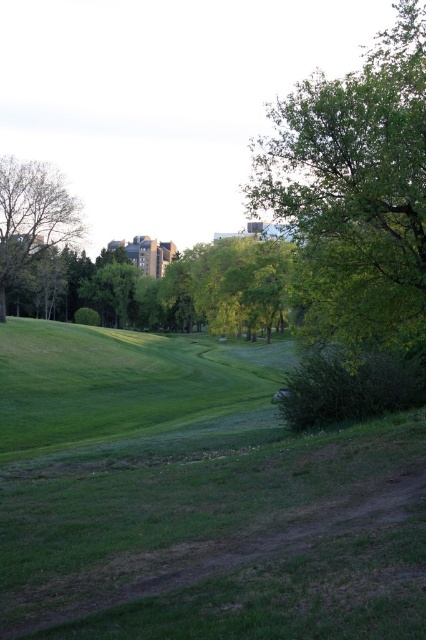
How much distance is there between green leafy tree at upper right and green leafy tree at left?

They are 137.24 feet apart.

Is green leafy tree at upper right above green leafy tree at left?

Correct, green leafy tree at upper right is located above green leafy tree at left.

The height and width of the screenshot is (640, 426). What do you see at coordinates (356, 186) in the screenshot?
I see `green leafy tree at upper right` at bounding box center [356, 186].

You are a GUI agent. You are given a task and a screenshot of the screen. Output one action in this format:
    pyautogui.click(x=<x>, y=<y>)
    Task: Click on the green leafy tree at upper right
    
    Given the screenshot: What is the action you would take?
    pyautogui.click(x=356, y=186)